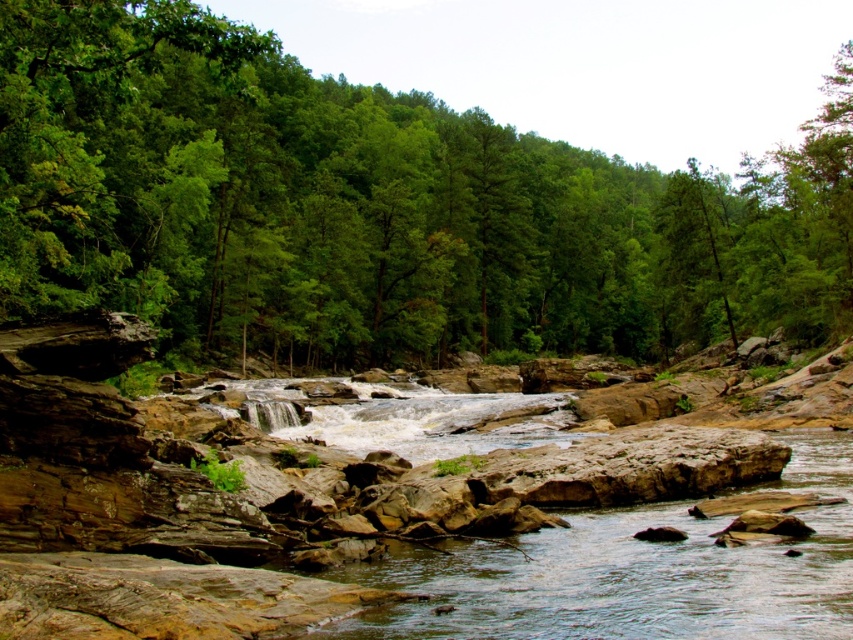
Is the position of green leafy tree at upper center more distant than that of brown rocky river at center?

Yes, it is behind brown rocky river at center.

What do you see at coordinates (376, 208) in the screenshot? The image size is (853, 640). I see `green leafy tree at upper center` at bounding box center [376, 208].

This screenshot has height=640, width=853. What are the coordinates of `green leafy tree at upper center` in the screenshot? It's located at (376, 208).